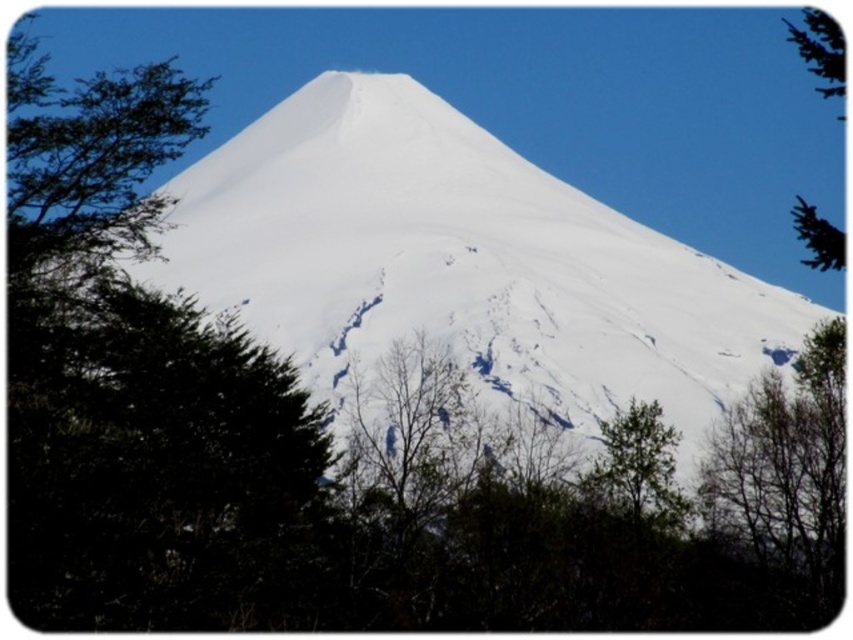
You are standing at the origin point of the image, which is the bottom left corner. You want to walk towards the green leafy tree at lower right. Which direction should you move in terms of x and y coordinates?

You should move towards the positive x and positive y direction since the green leafy tree at lower right is located at coordinate point (637, 468), which is to the right and above the origin point.